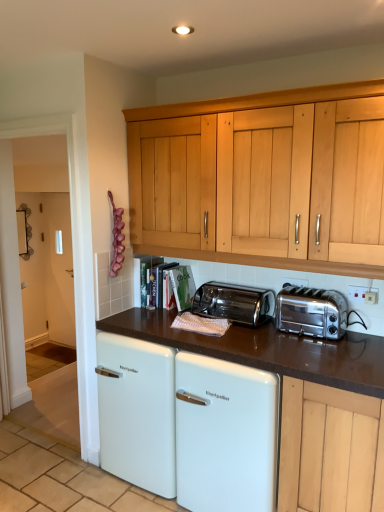
Locate an element on the screen. The image size is (384, 512). empty space that is ontop of white enamel refrigerator at center (from a real-world perspective) is located at coordinates (275, 335).